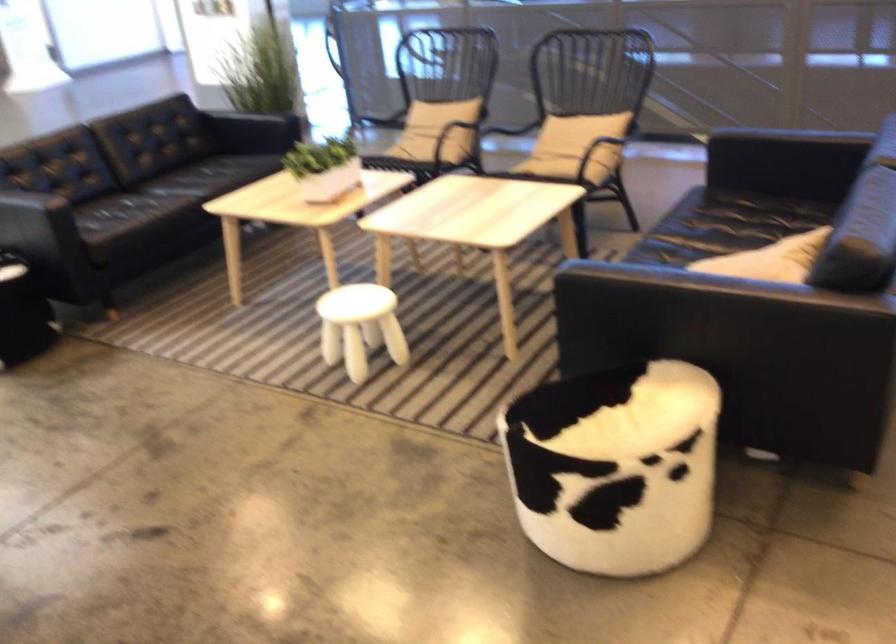
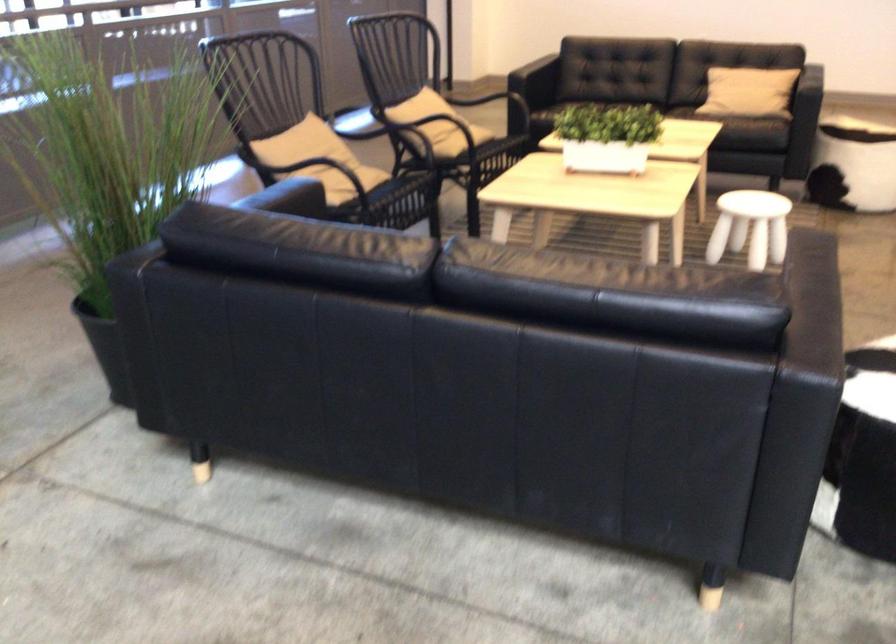
Where in the second image is the point corresponding to (322,166) from the first image?

(607, 137)